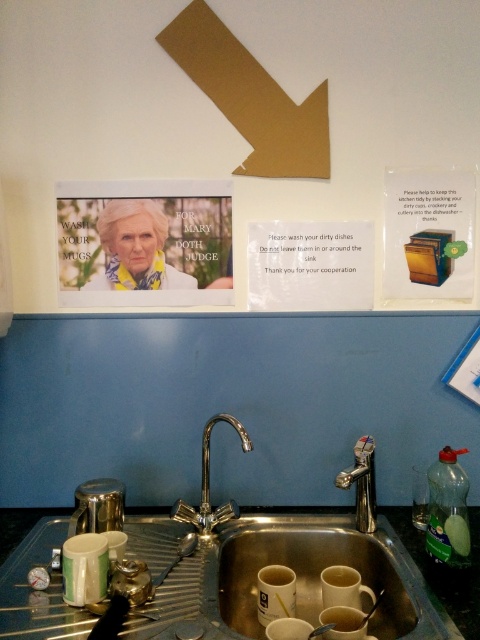
Between gold cardboard arrow at upper center and silver/metallic faucet at sink center, which one has more height?

gold cardboard arrow at upper center is taller.

Between gold cardboard arrow at upper center and silver/metallic faucet at sink center, which one appears on the left side from the viewer's perspective?

gold cardboard arrow at upper center

Where is `gold cardboard arrow at upper center`? The image size is (480, 640). gold cardboard arrow at upper center is located at coordinates (251, 97).

The height and width of the screenshot is (640, 480). In order to click on gold cardboard arrow at upper center in this screenshot , I will do `click(251, 97)`.

Is gold cardboard arrow at upper center shorter than polished chrome faucet at center?

No, gold cardboard arrow at upper center is not shorter than polished chrome faucet at center.

Find the location of a particular element. gold cardboard arrow at upper center is located at coordinates (251, 97).

Find the location of a particular element. This screenshot has height=640, width=480. gold cardboard arrow at upper center is located at coordinates (251, 97).

Does granite dark gray counter top at sink have a smaller size compared to silver/metallic faucet at sink center?

Actually, granite dark gray counter top at sink might be larger than silver/metallic faucet at sink center.

Which is behind, point (465, 604) or point (372, 486)?

The point (372, 486) is more distant.

Locate an element on the screen. granite dark gray counter top at sink is located at coordinates (444, 570).